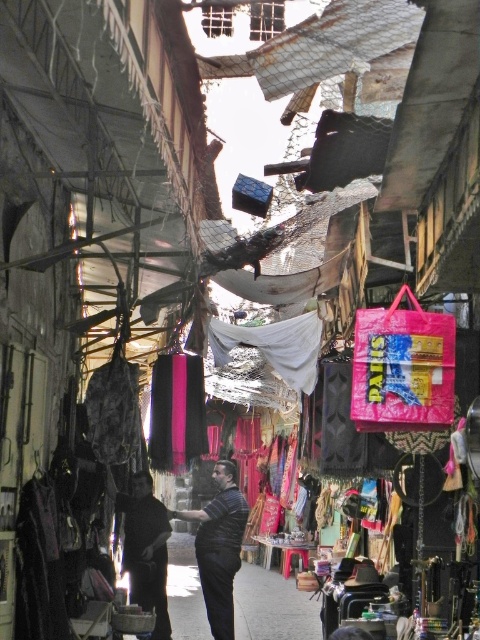
You are a customer at the market and see both the striped fabric shirt at center and the dark fabric bag at center hanging from the same rack. Which item is positioned to the right side of the other?

The striped fabric shirt at center is to the right of the dark fabric bag at center.

You are a traveler who wants to purchase a souvenir that can be easily seen from a distance. Which item between the striped fabric shirt at center and the dark fabric bag at center would you choose and why?

The striped fabric shirt at center has a greater height compared to the dark fabric bag at center, so it would be more visible from a distance, making it a better choice for an easily seen souvenir.

You are a customer in the market and want to buy the striped fabric shirt at center. You notice that the shirt is hanging at a certain position. Based on the coordinates provided, can you determine if the shirt is closer to the left or right side of the market stall?

The striped fabric shirt at center is located at point 0.855 on the x and y axis, which means it is closer to the right side of the market stall.